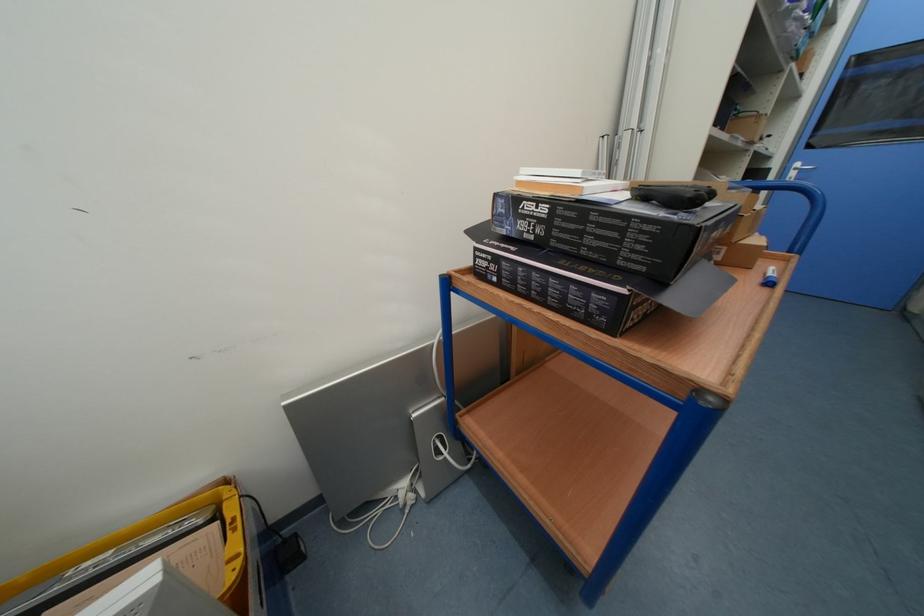
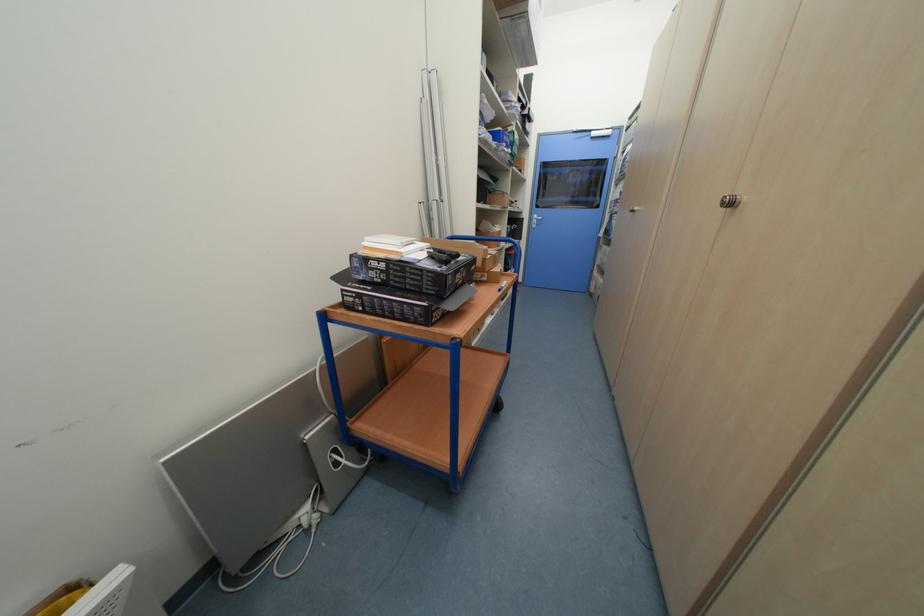
Question: The camera is either moving clockwise (left) or counter-clockwise (right) around the object. The first image is from the beginning of the video and the second image is from the end. Is the camera moving left or right when shooting the video?

Choices:
 (A) Left
 (B) Right

Answer: (A)